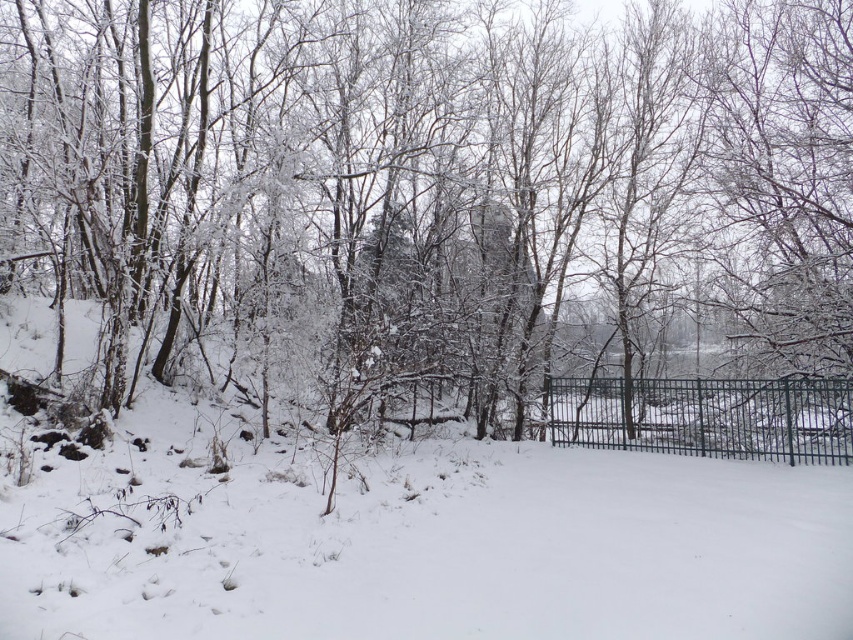
Is white frosty tree at center above metallic gate at center-right?

Correct, white frosty tree at center is located above metallic gate at center-right.

Can you confirm if white frosty tree at center is positioned to the left of metallic gate at center-right?

Indeed, white frosty tree at center is positioned on the left side of metallic gate at center-right.

Locate an element on the screen. Image resolution: width=853 pixels, height=640 pixels. white frosty tree at center is located at coordinates 450,209.

Is white fluffy snow at center wider than metallic gate at center-right?

Indeed, white fluffy snow at center has a greater width compared to metallic gate at center-right.

Does white fluffy snow at center have a lesser height compared to metallic gate at center-right?

No, white fluffy snow at center is not shorter than metallic gate at center-right.

Describe the element at coordinates (413, 540) in the screenshot. I see `white fluffy snow at center` at that location.

Identify the location of white fluffy snow at center. The height and width of the screenshot is (640, 853). (413, 540).

Which is more to the left, white frosty tree at center or white fluffy snow at center?

white fluffy snow at center is more to the left.

Between point (20, 17) and point (693, 630), which one is positioned behind?

Point (20, 17)

Image resolution: width=853 pixels, height=640 pixels. In order to click on white frosty tree at center in this screenshot , I will do `click(450, 209)`.